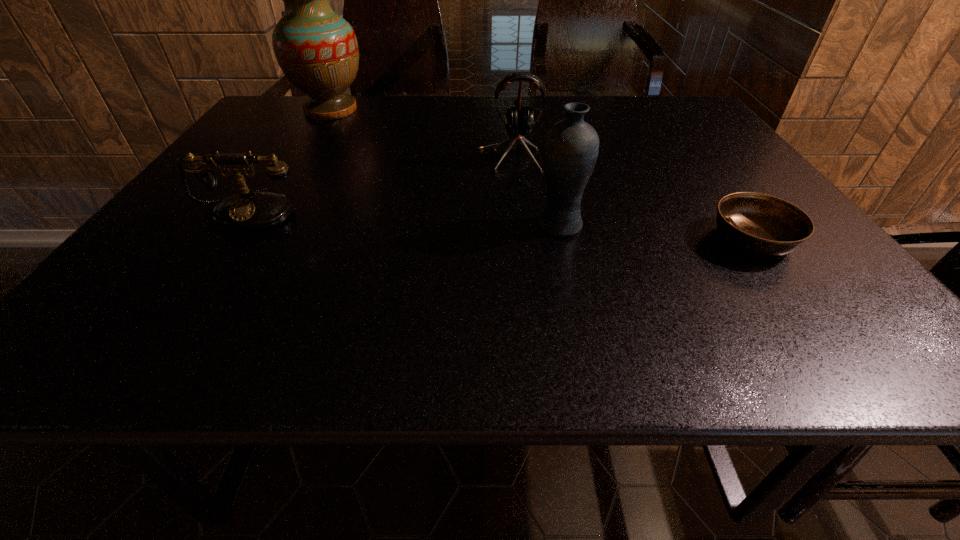
The image size is (960, 540). Identify the location of the left vase. (317, 50).

You are a GUI agent. You are given a task and a screenshot of the screen. Output one action in this format:
    pyautogui.click(x=<x>, y=<y>)
    Task: Click on the farthest object
    
    Given the screenshot: What is the action you would take?
    pyautogui.click(x=317, y=50)

Find the location of a particular element. This screenshot has height=540, width=960. the right vase is located at coordinates 570,150.

Image resolution: width=960 pixels, height=540 pixels. What are the coordinates of `the shorter vase` in the screenshot? It's located at (570, 150).

Where is `the third tallest object`? The height and width of the screenshot is (540, 960). the third tallest object is located at coordinates (518, 120).

Where is `the fourth nearest object`? The width and height of the screenshot is (960, 540). the fourth nearest object is located at coordinates (518, 120).

Locate an element on the screen. telephone is located at coordinates (249, 210).

Find the location of a particular element. Image resolution: width=960 pixels, height=540 pixels. soup bowl is located at coordinates (762, 224).

This screenshot has height=540, width=960. In order to click on the shortest object in this screenshot , I will do `click(762, 224)`.

Where is `vacant space situated on the front of the left vase`? The width and height of the screenshot is (960, 540). vacant space situated on the front of the left vase is located at coordinates (306, 151).